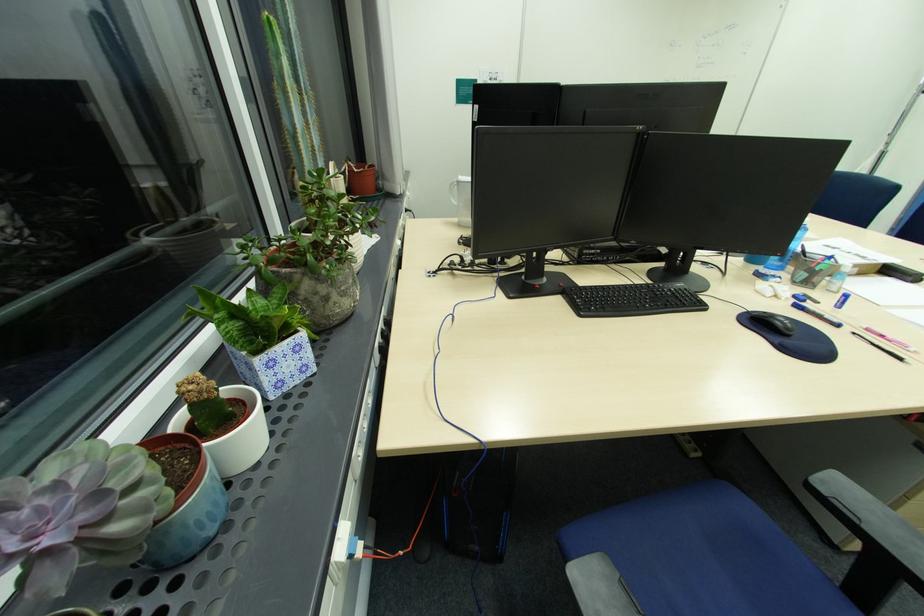
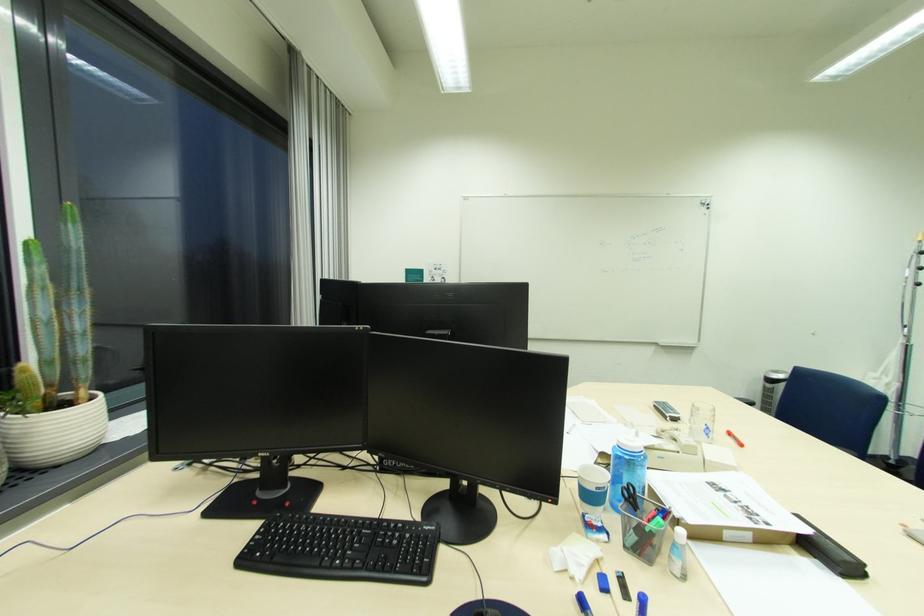
Where in the second image is the point corresponding to [896,277] from the first image?

(821, 557)